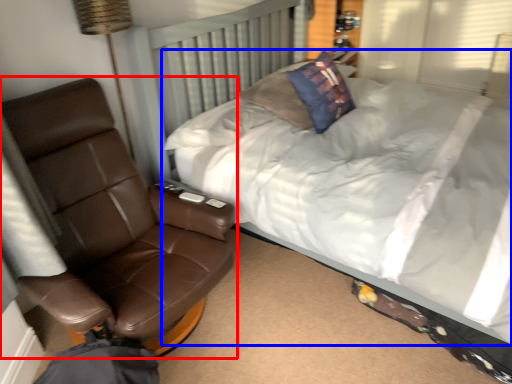
Question: Which object is closer to the camera taking this photo, chair (highlighted by a red box) or bed (highlighted by a blue box)?

Choices:
 (A) chair
 (B) bed

Answer: (B)